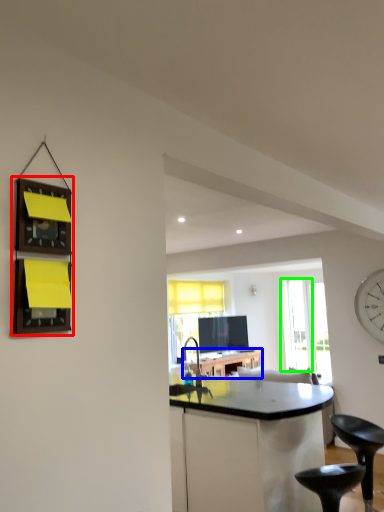
Question: Which object is the farthest from shelf (highlighted by a red box)? Choose among these: table (highlighted by a blue box) or glass door (highlighted by a green box).

Choices:
 (A) table
 (B) glass door

Answer: (B)